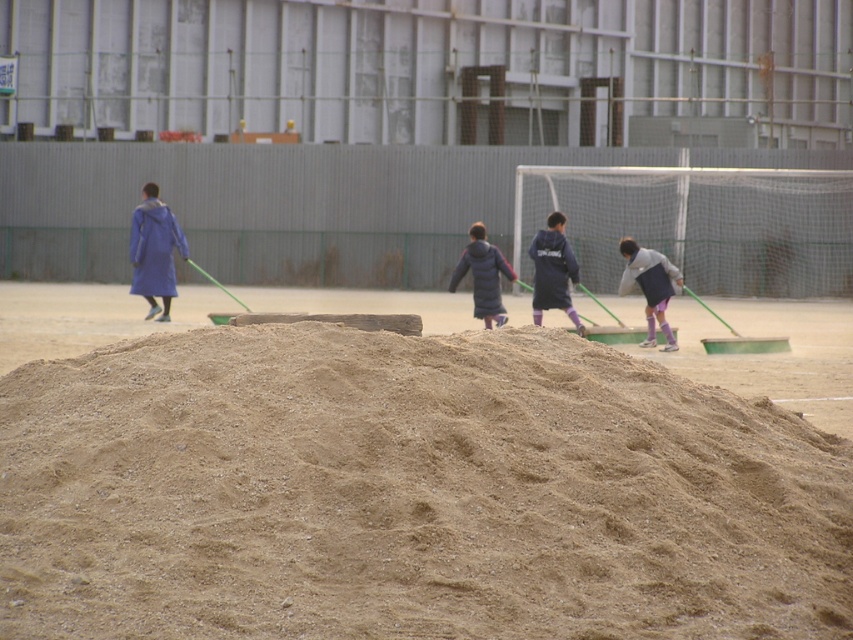
Can you confirm if light gray fabric jacket at right is positioned to the right of dark blue fleece jacket at center?

Yes, light gray fabric jacket at right is to the right of dark blue fleece jacket at center.

From the picture: Does light gray fabric jacket at right have a lesser width compared to dark blue fleece jacket at center?

Indeed, light gray fabric jacket at right has a lesser width compared to dark blue fleece jacket at center.

Where is `light gray fabric jacket at right`? Image resolution: width=853 pixels, height=640 pixels. light gray fabric jacket at right is located at coordinates point(650,285).

What are the coordinates of `light gray fabric jacket at right` in the screenshot? It's located at (650, 285).

Who is positioned more to the left, matte blue coat at left or dark blue fleece jacket at center?

From the viewer's perspective, matte blue coat at left appears more on the left side.

This screenshot has width=853, height=640. In order to click on matte blue coat at left in this screenshot , I will do `click(154, 252)`.

Based on the photo, which is more to the left, light gray fabric jacket at right or dark blue puffy jacket at center?

Positioned to the left is dark blue puffy jacket at center.

Which is below, light gray fabric jacket at right or dark blue puffy jacket at center?

light gray fabric jacket at right is below.

Who is more distant from viewer, (657, 268) or (459, 262)?

Positioned behind is point (657, 268).

Find the location of a particular element. The width and height of the screenshot is (853, 640). light gray fabric jacket at right is located at coordinates (650, 285).